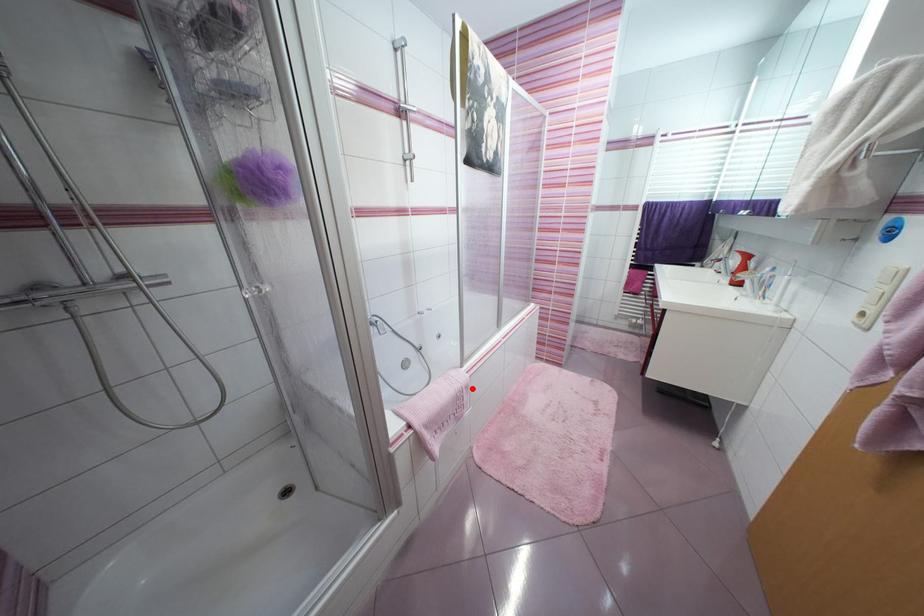
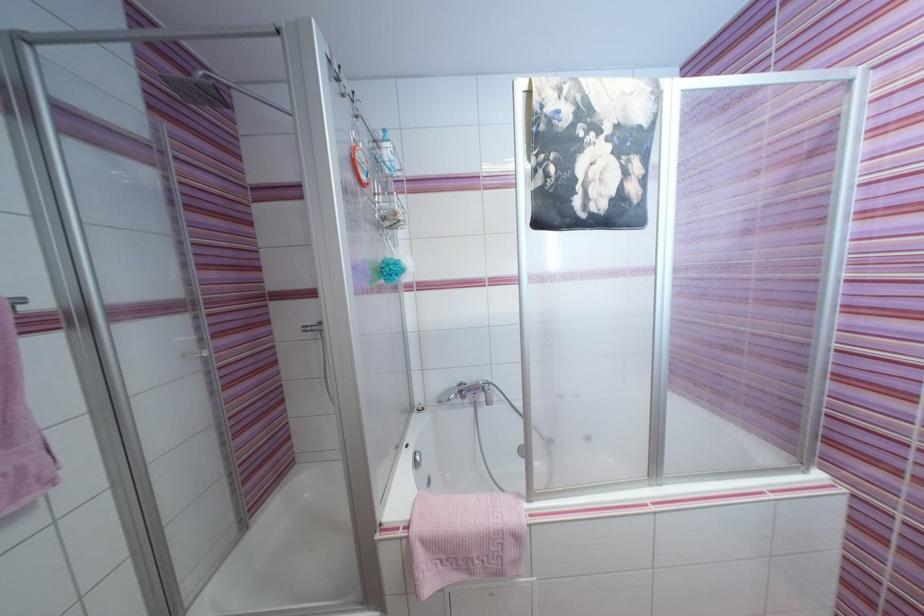
Find the pixel in the second image that matches the highlighted location in the first image.

(521, 539)